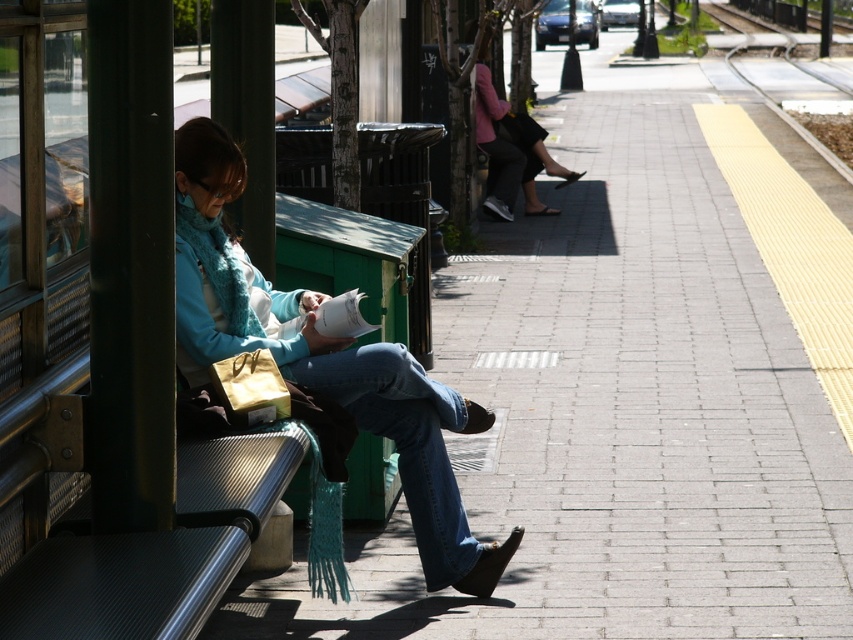
Question: In this image, where is blue denim jeans at center located relative to pink fabric jacket at upper center?

Choices:
 (A) right
 (B) left

Answer: (B)

Question: Which object appears farthest from the camera in this image?

Choices:
 (A) pink fabric jacket at upper center
 (B) blue denim jeans at center

Answer: (A)

Question: Among these points, which one is nearest to the camera?

Choices:
 (A) (314, 305)
 (B) (532, 132)

Answer: (A)

Question: In this image, where is blue denim jeans at center located relative to pink fabric jacket at upper center?

Choices:
 (A) below
 (B) above

Answer: (A)

Question: Can you confirm if blue denim jeans at center is wider than pink fabric jacket at upper center?

Choices:
 (A) yes
 (B) no

Answer: (A)